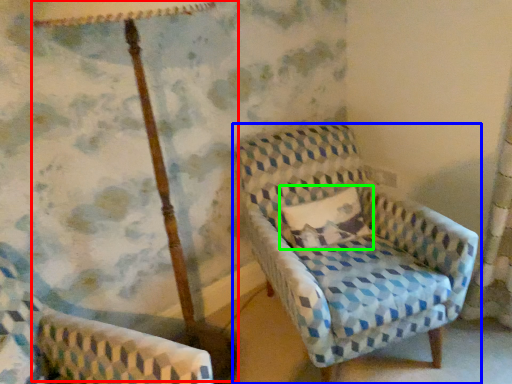
Question: Estimate the real-world distances between objects in this image. Which object is closer to table lamp (highlighted by a red box), chair (highlighted by a blue box) or pillow (highlighted by a green box)?

Choices:
 (A) chair
 (B) pillow

Answer: (B)